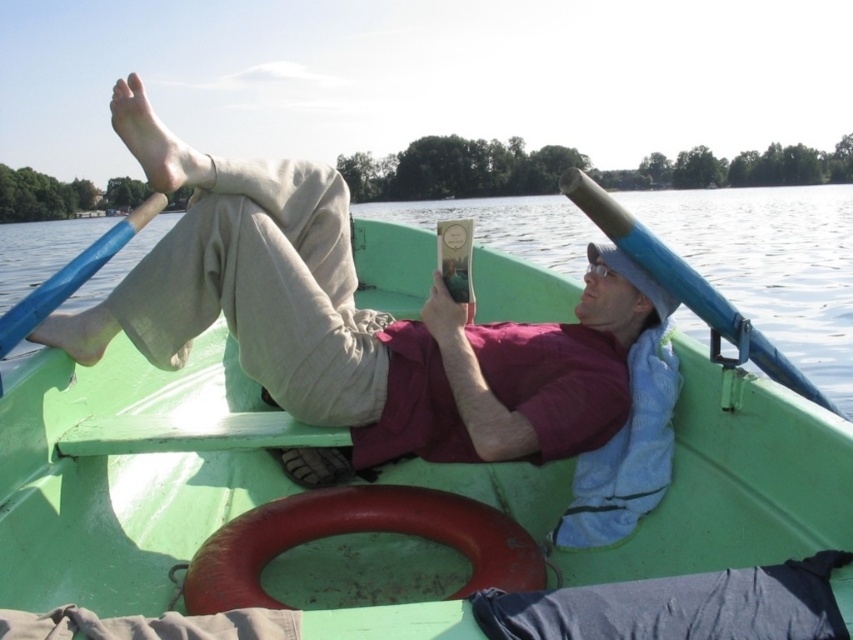
Question: Can you confirm if green matte boat at center is bigger than matte khaki pants at center?

Choices:
 (A) yes
 (B) no

Answer: (A)

Question: Does green matte boat at center appear under matte khaki pants at center?

Choices:
 (A) yes
 (B) no

Answer: (B)

Question: Which object appears closest to the camera in this image?

Choices:
 (A) green matte boat at center
 (B) matte khaki pants at center

Answer: (A)

Question: In this image, where is green matte boat at center located relative to matte khaki pants at center?

Choices:
 (A) left
 (B) right

Answer: (B)